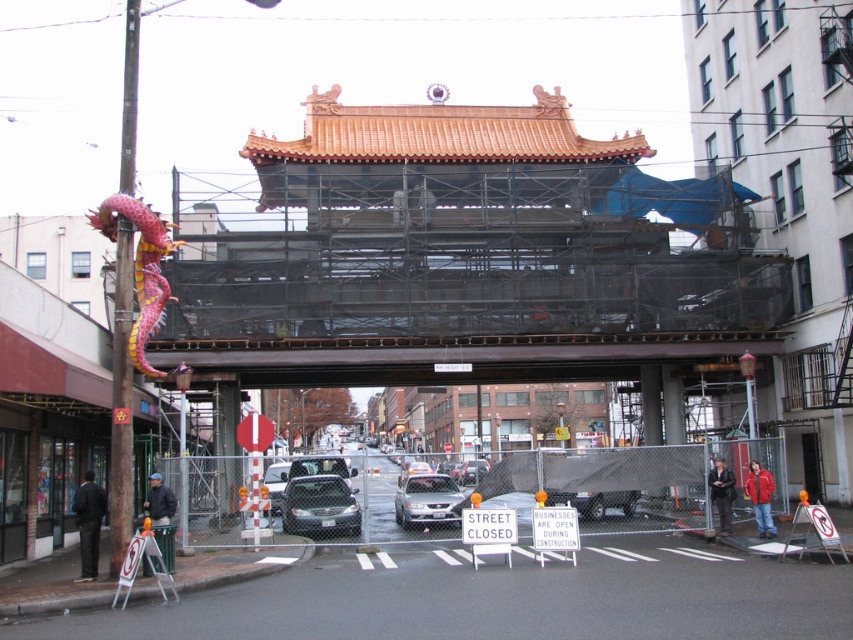
Can you confirm if matte black sedan at center is positioned below silver metallic sedan at center?

Indeed, matte black sedan at center is positioned under silver metallic sedan at center.

Is point (347, 493) positioned in front of point (444, 513)?

Yes, it is.

Image resolution: width=853 pixels, height=640 pixels. I want to click on matte black sedan at center, so click(318, 506).